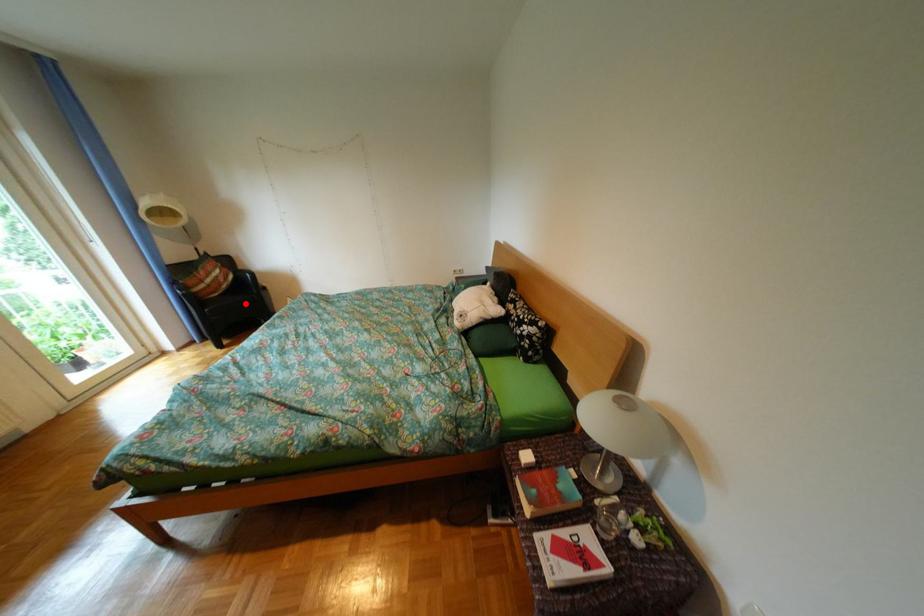
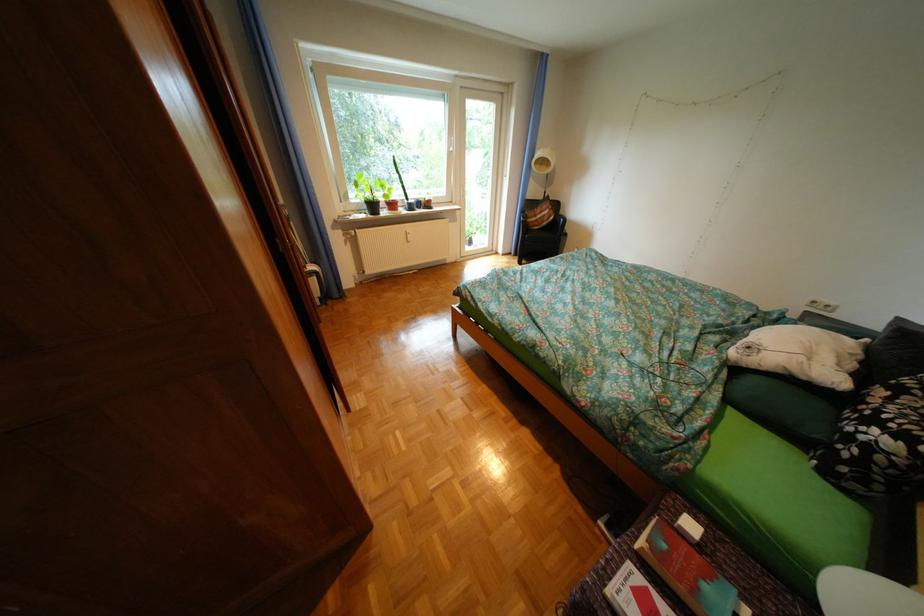
Question: I am providing you with two images of the same scene from different viewpoints. Given a red point in image1, look at the same physical point in image2. Is it:

Choices:
 (A) Closer to the viewpoint
 (B) Farther from the viewpoint

Answer: (A)